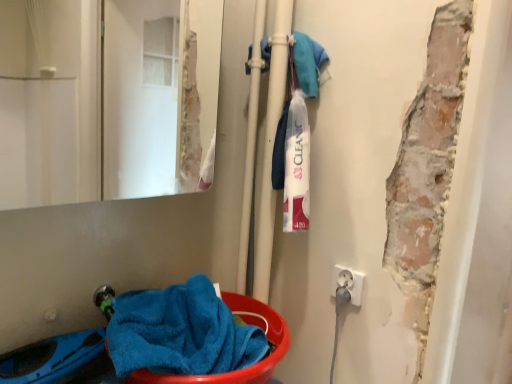
Question: Considering the positions of white plastic electrical outlet at lower right and blue soft towel at lower left in the image, is white plastic electrical outlet at lower right taller or shorter than blue soft towel at lower left?

Choices:
 (A) short
 (B) tall

Answer: (A)

Question: Based on their sizes in the image, would you say white plastic electrical outlet at lower right is bigger or smaller than blue soft towel at lower left?

Choices:
 (A) big
 (B) small

Answer: (B)

Question: Which is nearer to the blue soft towel at lower left?

Choices:
 (A) matte glass mirror at upper left
 (B) white plastic electrical outlet at lower right

Answer: (B)

Question: Estimate the real-world distances between objects in this image. Which object is closer to the matte glass mirror at upper left?

Choices:
 (A) white plastic electrical outlet at lower right
 (B) blue soft towel at lower left

Answer: (B)